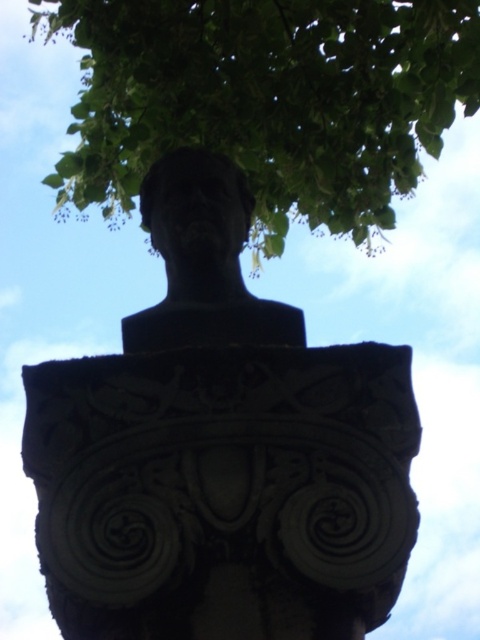
Question: Is black stone bust at center smaller than black stone bust at upper center?

Choices:
 (A) no
 (B) yes

Answer: (A)

Question: Considering the real-world distances, which object is closest to the black stone bust at upper center?

Choices:
 (A) black stone bust at center
 (B) green leafy tree at upper center

Answer: (A)

Question: Estimate the real-world distances between objects in this image. Which object is closer to the green leafy tree at upper center?

Choices:
 (A) black stone bust at upper center
 (B) black stone bust at center

Answer: (A)

Question: Which point is closer to the camera?

Choices:
 (A) [x=239, y=275]
 (B) [x=304, y=403]
 (C) [x=140, y=109]

Answer: (B)

Question: Does green leafy tree at upper center appear on the left side of black stone bust at upper center?

Choices:
 (A) yes
 (B) no

Answer: (A)

Question: Does black stone bust at center have a greater width compared to black stone bust at upper center?

Choices:
 (A) no
 (B) yes

Answer: (B)